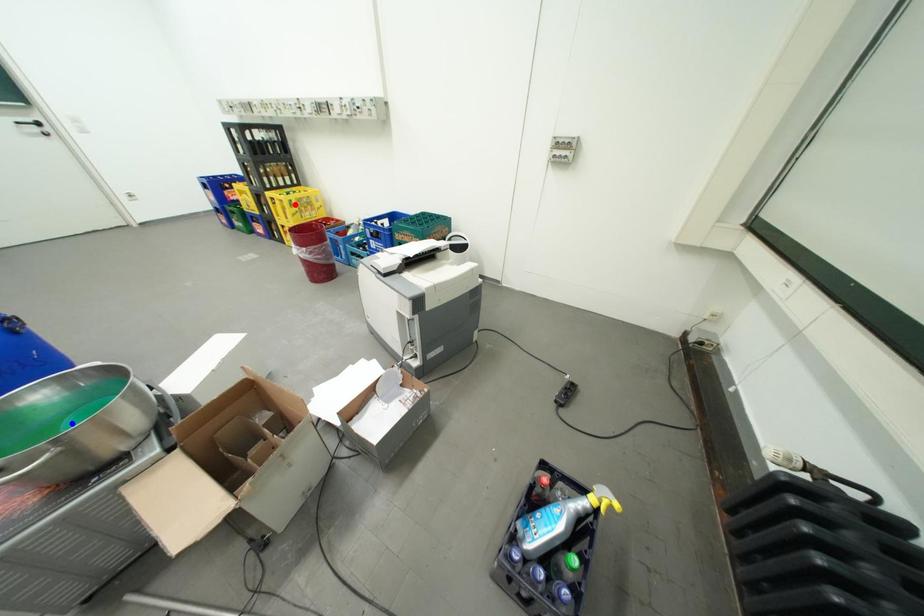
Question: Two points are marked on the image. Which point is closer to the camera?

Choices:
 (A) Blue point is closer.
 (B) Red point is closer.

Answer: (A)